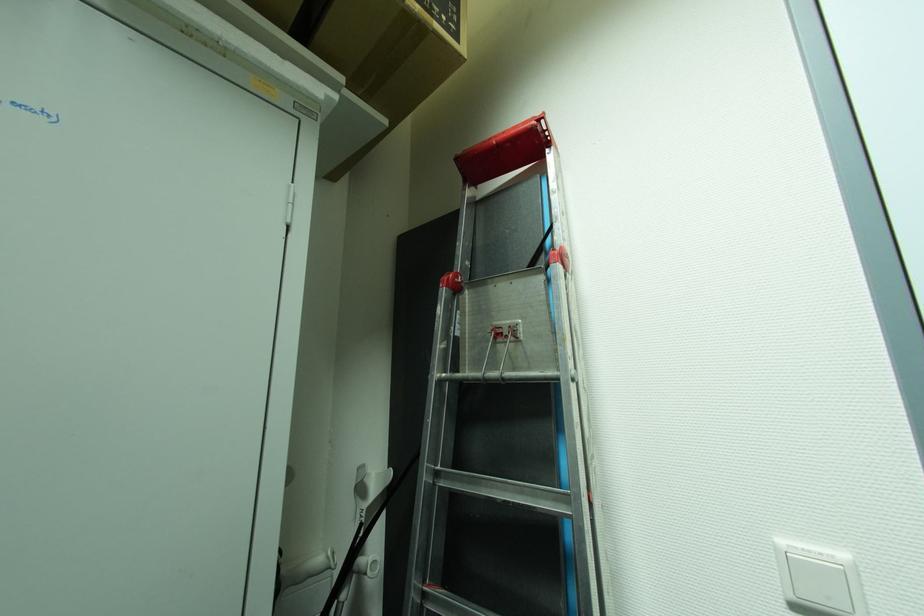
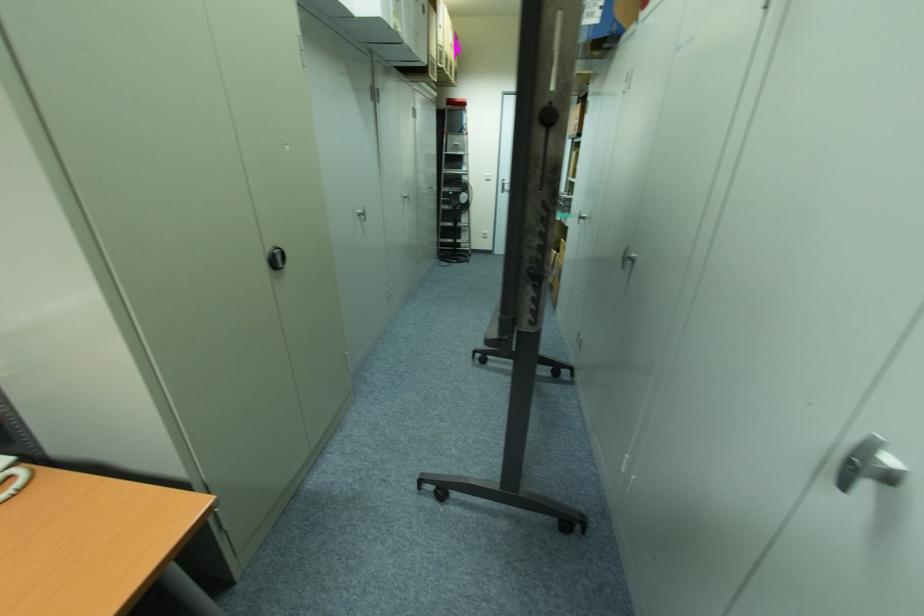
Where in the second image is the point corresponding to (551,144) from the first image?

(468, 108)